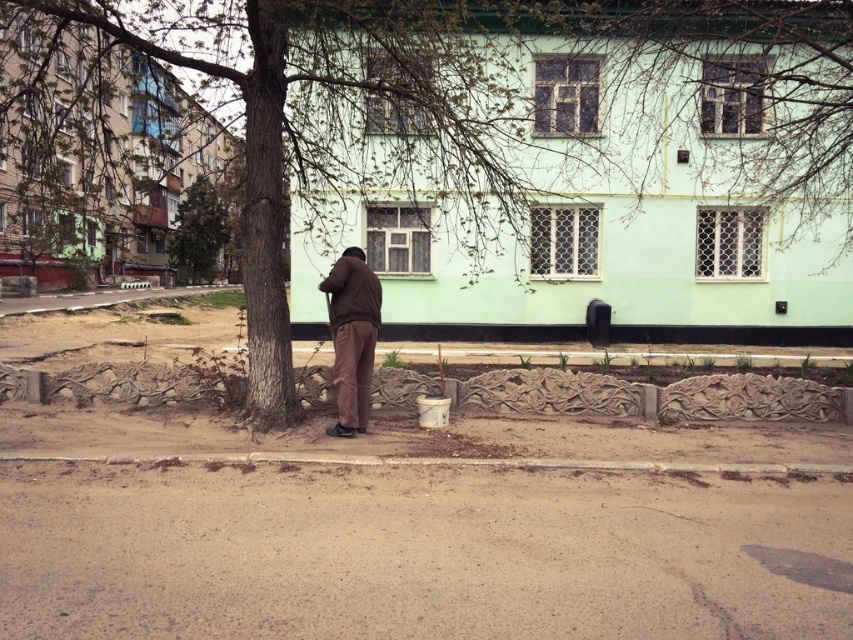
Question: Which object is farther from the camera taking this photo?

Choices:
 (A) brown bark tree at center
 (B) brown matte jacket at center
 (C) green leafy tree at upper left

Answer: (C)

Question: Which object is closer to the camera taking this photo?

Choices:
 (A) brown bark tree at center
 (B) brown matte jacket at center

Answer: (A)

Question: Can you confirm if brown matte jacket at center is positioned to the right of green leafy tree at upper left?

Choices:
 (A) no
 (B) yes

Answer: (B)

Question: Is brown matte jacket at center positioned at the back of green leafy tree at upper left?

Choices:
 (A) yes
 (B) no

Answer: (B)

Question: Based on their relative distances, which object is farther from the brown matte jacket at center?

Choices:
 (A) brown bark tree at center
 (B) green leafy tree at upper left

Answer: (B)

Question: Is brown bark tree at center to the right of brown matte jacket at center from the viewer's perspective?

Choices:
 (A) no
 (B) yes

Answer: (B)